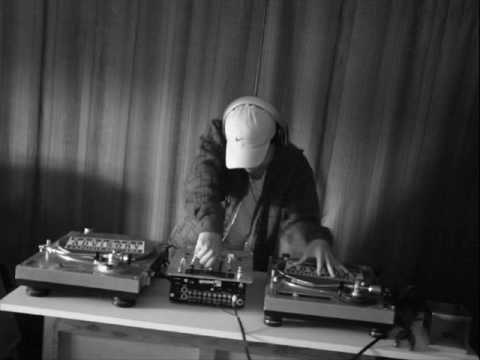
Find the location of a particular element. turntable is located at coordinates (302, 277).